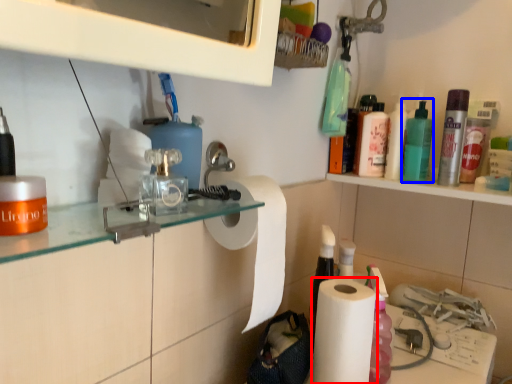
Question: Which point is closer to the camera, paper towel (highlighted by a red box) or mouthwash (highlighted by a blue box)?

Choices:
 (A) paper towel
 (B) mouthwash

Answer: (A)